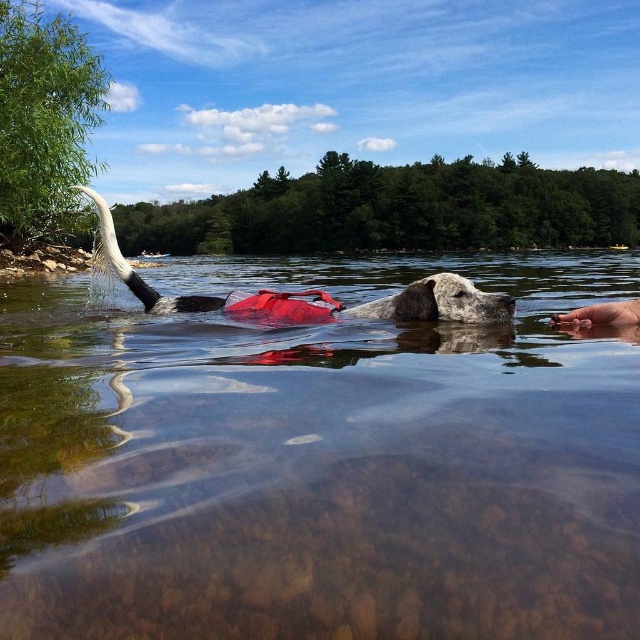
Question: Where is gray fur dog at center located in relation to smooth skin hand at lower right in the image?

Choices:
 (A) below
 (B) above

Answer: (B)

Question: Which of the following is the closest to the observer?

Choices:
 (A) clear water at center
 (B) red rubber life jacket at center

Answer: (A)

Question: Is clear water at center wider than red rubber life jacket at center?

Choices:
 (A) yes
 (B) no

Answer: (A)

Question: Which point is closer to the camera?

Choices:
 (A) clear water at center
 (B) smooth skin hand at lower right
 (C) red rubber life jacket at center
 (D) gray fur dog at center

Answer: (A)

Question: From the image, what is the correct spatial relationship of clear water at center in relation to smooth skin hand at lower right?

Choices:
 (A) left
 (B) right

Answer: (A)

Question: Which point is farther from the camera taking this photo?

Choices:
 (A) click(x=572, y=323)
 (B) click(x=260, y=308)

Answer: (B)